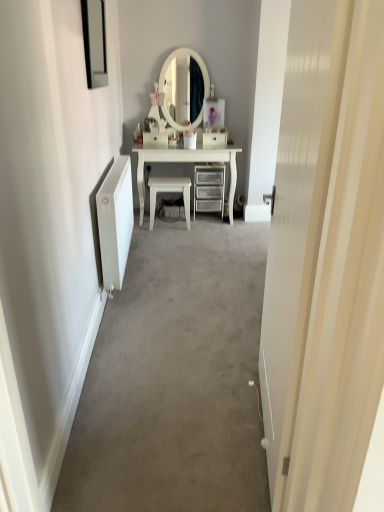
The height and width of the screenshot is (512, 384). I want to click on free point above white glossy drawer at center, the 1th drawer viewed from the left (from a real-world perspective), so click(x=152, y=130).